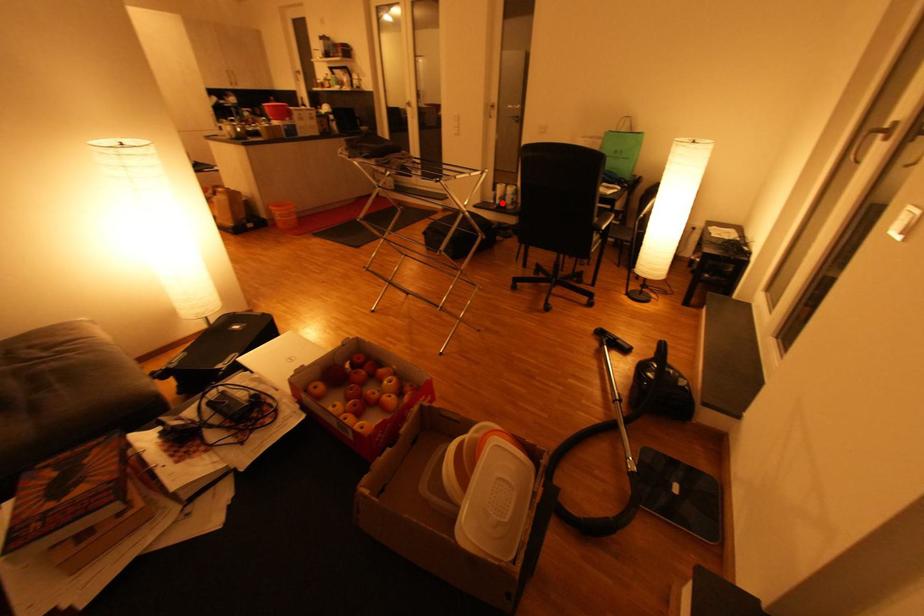
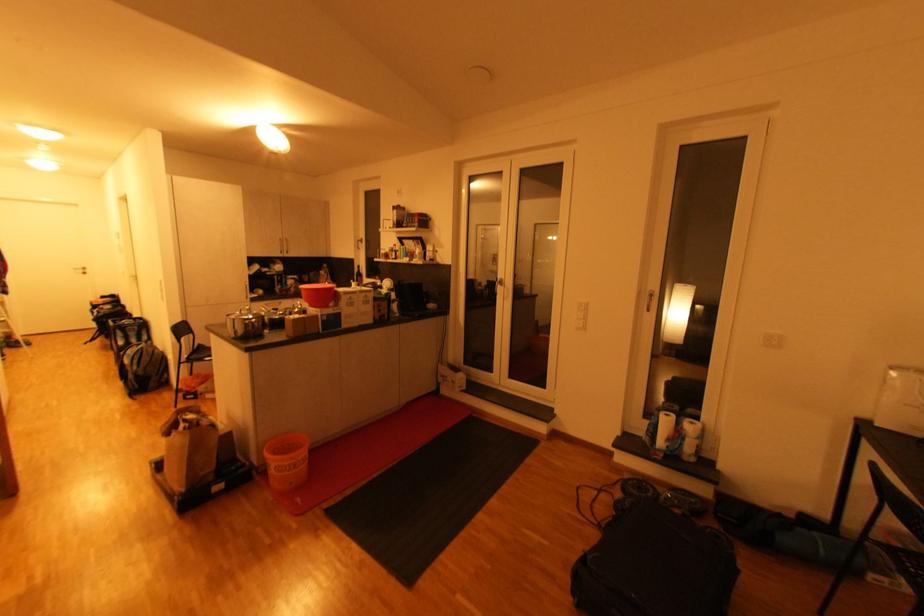
Question: I am providing you with two images of the same scene from different viewpoints. Image1 has a red point marked. In image2, the corresponding 3D location appears at what relative position? Reply with the corresponding letter.

Choices:
 (A) Closer
 (B) Farther

Answer: (B)